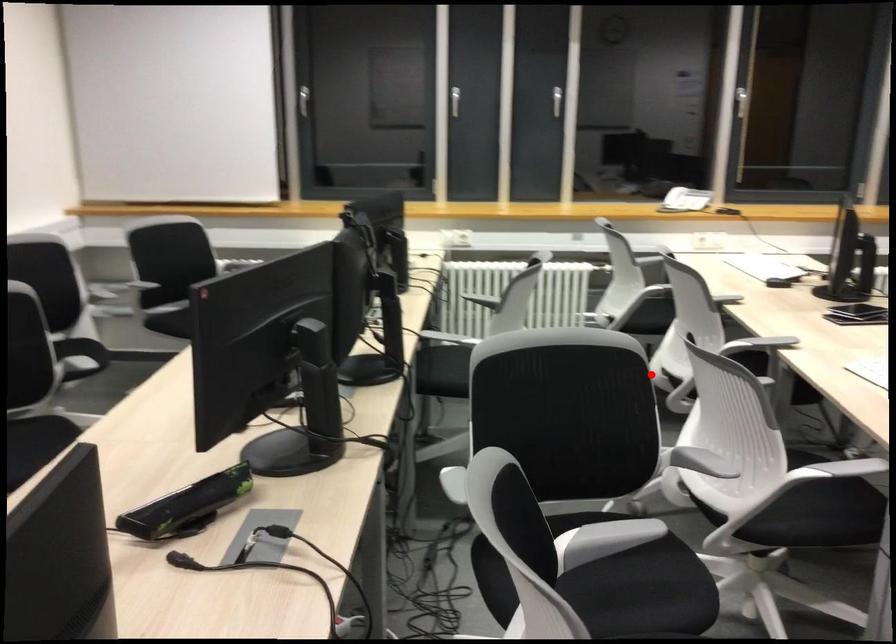
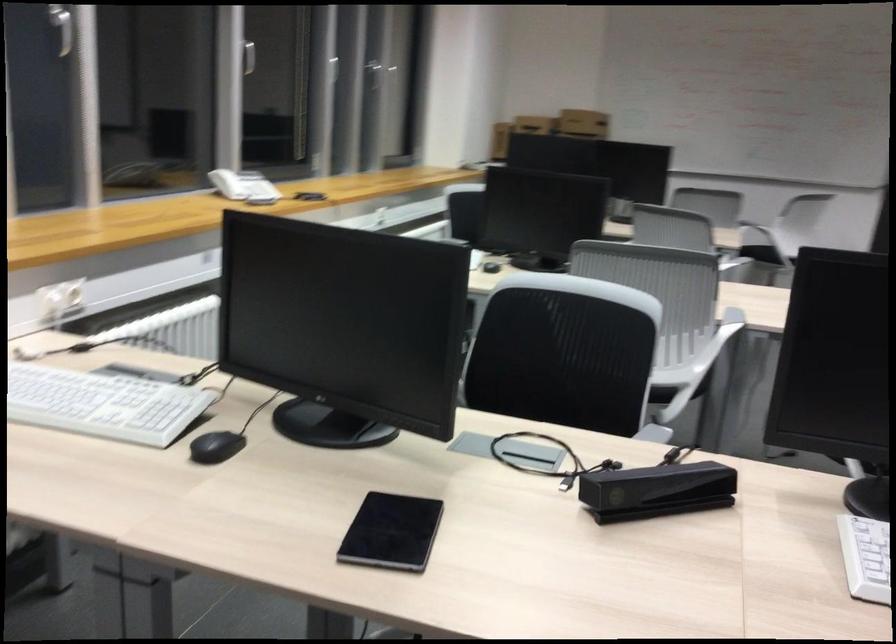
Question: I am providing you with two images of the same scene from different viewpoints. Image1 has a red point marked. In image2, the corresponding 3D location appears at what relative position? Reply with the corresponding letter.

Choices:
 (A) Closer
 (B) Farther

Answer: (A)